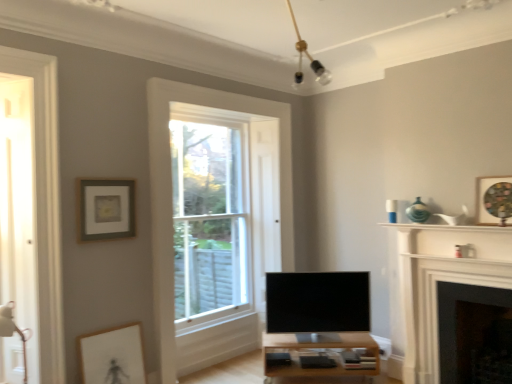
Question: Is point (230, 271) positioned closer to the camera than point (358, 340)?

Choices:
 (A) farther
 (B) closer

Answer: (A)

Question: Is clear glass window at center inside or outside of light wood table at center?

Choices:
 (A) outside
 (B) inside

Answer: (A)

Question: Based on their relative distances, which object is nearer to the white wood fireplace at right, the 2th fireplace positioned from the right?

Choices:
 (A) silver metallic tv at center
 (B) dark gray stone fireplace at lower right, the 2th fireplace when ordered from left to right
 (C) white glossy shelf at upper right
 (D) clear glass window at center
 (E) light wood table at center

Answer: (B)

Question: Which object is the closest to the light wood table at center?

Choices:
 (A) white glossy shelf at upper right
 (B) wooden textured picture frame at upper right, which ranks as the 1th picture frame in right-to-left order
 (C) white wood fireplace at right, the 2th fireplace positioned from the right
 (D) matte gray picture frame at upper left, which appears as the third picture frame when viewed from the right
 (E) matte white picture frame at lower left, which is the 2th picture frame from left to right

Answer: (C)